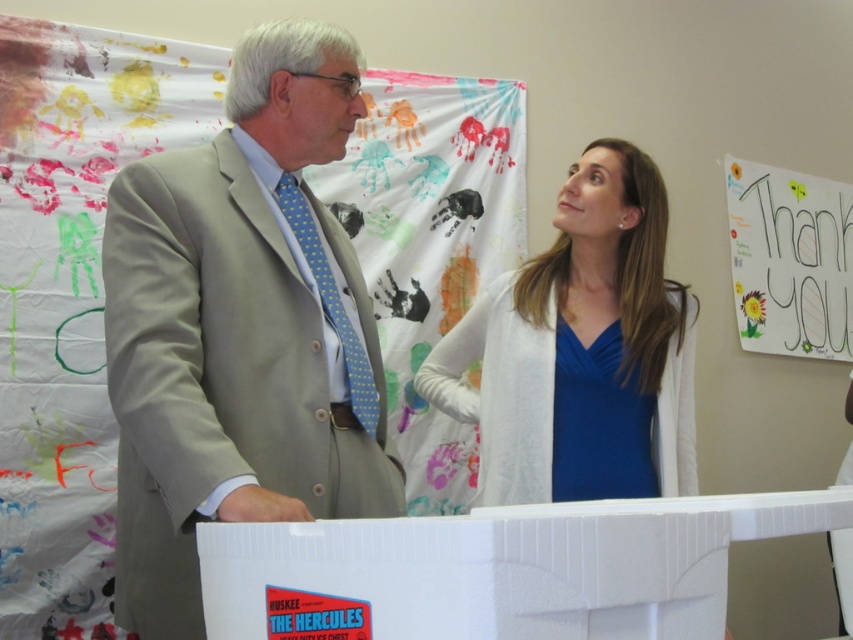
Question: Where is white plastic container at center located in relation to white paperboard at upper right in the image?

Choices:
 (A) below
 (B) above

Answer: (A)

Question: Which object is positioned farthest from the blue satin blouse at upper center?

Choices:
 (A) white paperboard at upper right
 (B) white plastic container at center

Answer: (A)

Question: Is light beige suit at center smaller than white paperboard at upper right?

Choices:
 (A) no
 (B) yes

Answer: (A)

Question: Among these objects, which one is nearest to the camera?

Choices:
 (A) white plastic container at center
 (B) light beige suit at center
 (C) white paperboard at upper right
 (D) blue satin blouse at upper center

Answer: (A)

Question: Can you confirm if light beige suit at center is positioned below blue satin blouse at upper center?

Choices:
 (A) yes
 (B) no

Answer: (A)

Question: Which object is farther from the camera taking this photo?

Choices:
 (A) light beige suit at center
 (B) white plastic container at center
 (C) blue satin blouse at upper center
 (D) white paperboard at upper right

Answer: (D)